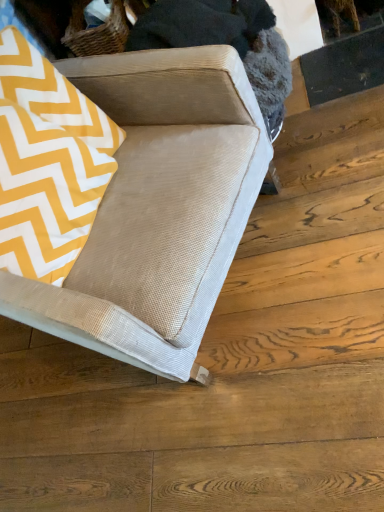
Describe the element at coordinates (47, 163) in the screenshot. I see `yellow zigzag fabric at upper left` at that location.

What is the approximate width of yellow zigzag fabric at upper left?

The width of yellow zigzag fabric at upper left is 10.17 inches.

At what (x,y) coordinates should I click in order to perform the action: click on yellow zigzag fabric at upper left. Please return your answer as a coordinate pair (x, y). The height and width of the screenshot is (512, 384). Looking at the image, I should click on (47, 163).

This screenshot has width=384, height=512. I want to click on beige corduroy couch at center, so click(x=125, y=196).

Describe the element at coordinates (125, 196) in the screenshot. I see `beige corduroy couch at center` at that location.

Where is `yellow zigzag fabric at upper left`? yellow zigzag fabric at upper left is located at coordinates (47, 163).

Is beige corduroy couch at center to the left or to the right of yellow zigzag fabric at upper left in the image?

Based on their positions, beige corduroy couch at center is located to the right of yellow zigzag fabric at upper left.

Is beige corduroy couch at center further to the viewer compared to yellow zigzag fabric at upper left?

No, it is in front of yellow zigzag fabric at upper left.

Is point (63, 284) closer to viewer compared to point (38, 158)?

No, (63, 284) is behind (38, 158).

From the image's perspective, which object appears higher, beige corduroy couch at center or yellow zigzag fabric at upper left?

yellow zigzag fabric at upper left.

From a real-world perspective, is beige corduroy couch at center physically below yellow zigzag fabric at upper left?

Yes, from a real-world perspective, beige corduroy couch at center is under yellow zigzag fabric at upper left.

From the picture: Is beige corduroy couch at center wider or thinner than yellow zigzag fabric at upper left?

Clearly, beige corduroy couch at center has more width compared to yellow zigzag fabric at upper left.

From their relative heights in the image, would you say beige corduroy couch at center is taller or shorter than yellow zigzag fabric at upper left?

beige corduroy couch at center is taller than yellow zigzag fabric at upper left.

Who is bigger, beige corduroy couch at center or yellow zigzag fabric at upper left?

beige corduroy couch at center.

Is beige corduroy couch at center positioned beyond the bounds of yellow zigzag fabric at upper left?

Absolutely, beige corduroy couch at center is external to yellow zigzag fabric at upper left.

Is beige corduroy couch at center far away from yellow zigzag fabric at upper left?

No, beige corduroy couch at center is in close proximity to yellow zigzag fabric at upper left.

Is beige corduroy couch at center facing away from yellow zigzag fabric at upper left?

Correct, beige corduroy couch at center is looking away from yellow zigzag fabric at upper left.

At what (x,y) coordinates should I click in order to perform the action: click on studio couch that is in front of the yellow zigzag fabric at upper left. Please return your answer as a coordinate pair (x, y). Image resolution: width=384 pixels, height=512 pixels. Looking at the image, I should click on (125, 196).

Between yellow zigzag fabric at upper left and beige corduroy couch at center, which one appears on the left side from the viewer's perspective?

yellow zigzag fabric at upper left is more to the left.

Considering the positions of objects yellow zigzag fabric at upper left and beige corduroy couch at center in the image provided, who is in front, yellow zigzag fabric at upper left or beige corduroy couch at center?

beige corduroy couch at center is more forward.

Does point (85, 118) come behind point (225, 224)?

Yes, point (85, 118) is behind point (225, 224).

From the image's perspective, is yellow zigzag fabric at upper left below beige corduroy couch at center?

Actually, yellow zigzag fabric at upper left appears above beige corduroy couch at center in the image.

Based on the photo, from a real-world perspective, which is physically below, yellow zigzag fabric at upper left or beige corduroy couch at center?

beige corduroy couch at center, from a real-world perspective.

Does yellow zigzag fabric at upper left have a greater width compared to beige corduroy couch at center?

In fact, yellow zigzag fabric at upper left might be narrower than beige corduroy couch at center.

Who is shorter, yellow zigzag fabric at upper left or beige corduroy couch at center?

yellow zigzag fabric at upper left.

Which of these two, yellow zigzag fabric at upper left or beige corduroy couch at center, is bigger?

beige corduroy couch at center.

Looking at this image, is beige corduroy couch at center completely or partially inside yellow zigzag fabric at upper left?

No, beige corduroy couch at center is not surrounded by yellow zigzag fabric at upper left.

Is yellow zigzag fabric at upper left positioned far away from beige corduroy couch at center?

yellow zigzag fabric at upper left is near beige corduroy couch at center, not far away.

Could you tell me if yellow zigzag fabric at upper left is facing beige corduroy couch at center?

Yes, yellow zigzag fabric at upper left is oriented towards beige corduroy couch at center.

Measure the distance between yellow zigzag fabric at upper left and beige corduroy couch at center.

They are 4.47 inches apart.

The height and width of the screenshot is (512, 384). Identify the location of studio couch below the yellow zigzag fabric at upper left (from the image's perspective). (125, 196).

Identify the location of throw pillow above the beige corduroy couch at center (from the image's perspective). The height and width of the screenshot is (512, 384). (47, 163).

You are a GUI agent. You are given a task and a screenshot of the screen. Output one action in this format:
    pyautogui.click(x=<x>, y=<y>)
    Task: Click on the studio couch below the yellow zigzag fabric at upper left (from the image's perspective)
    Image resolution: width=384 pixels, height=512 pixels.
    Given the screenshot: What is the action you would take?
    tap(125, 196)